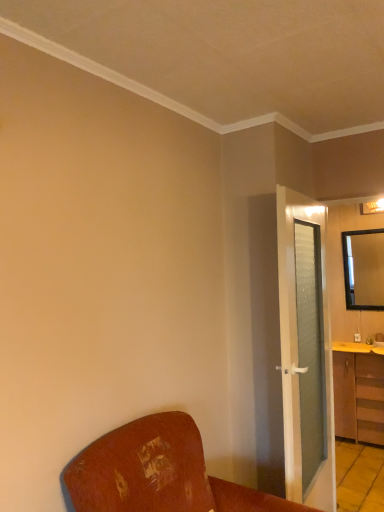
Question: Is wooden cabinet at right wider or thinner than black framed mirror at upper right?

Choices:
 (A) wide
 (B) thin

Answer: (A)

Question: Choose the correct answer: Is wooden cabinet at right inside black framed mirror at upper right or outside it?

Choices:
 (A) inside
 (B) outside

Answer: (B)

Question: Based on their relative distances, which object is farther from the wooden cabinet at right?

Choices:
 (A) wooden chair at lower left
 (B) black framed mirror at upper right
 (C) green frosted glass door at right
 (D) yellow wood counter top at right

Answer: (A)

Question: Which of these objects is positioned closest to the yellow wood counter top at right?

Choices:
 (A) green frosted glass door at right
 (B) wooden chair at lower left
 (C) black framed mirror at upper right
 (D) wooden cabinet at right

Answer: (D)